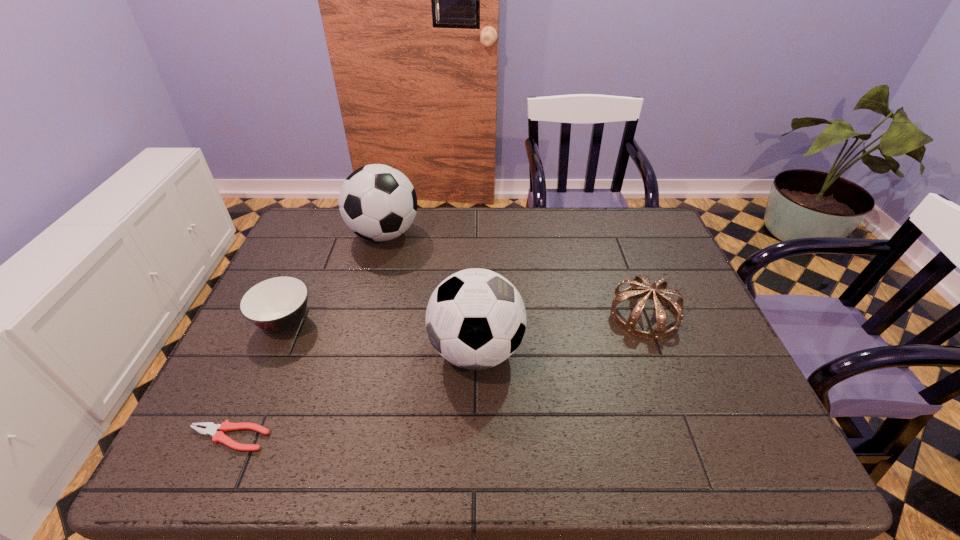
At what (x,y) coordinates should I click in order to perform the action: click on free space at the far edge. Please return your answer as a coordinate pair (x, y). The width and height of the screenshot is (960, 540). Looking at the image, I should click on (516, 234).

Identify the location of free space at the near edge of the desktop. (293, 467).

The width and height of the screenshot is (960, 540). In order to click on free point at the left edge in this screenshot , I will do `click(280, 269)`.

Identify the location of vacant position at the right edge of the desktop. The image size is (960, 540). (683, 326).

Find the location of a particular element. The width and height of the screenshot is (960, 540). free space at the far left corner is located at coordinates (300, 230).

This screenshot has height=540, width=960. Identify the location of blank space at the far right corner. (615, 231).

You are a GUI agent. You are given a task and a screenshot of the screen. Output one action in this format:
    pyautogui.click(x=<x>, y=<y>)
    Task: Click on the free space between the right soccer ball and the left soccer ball
    Image resolution: width=960 pixels, height=540 pixels.
    Given the screenshot: What is the action you would take?
    pyautogui.click(x=430, y=292)

Locate an element on the screen. This screenshot has width=960, height=540. free space between the nearer soccer ball and the rightmost object is located at coordinates (560, 333).

You are a GUI agent. You are given a task and a screenshot of the screen. Output one action in this format:
    pyautogui.click(x=<x>, y=<y>)
    Task: Click on the vacant area between the nearer soccer ball and the rightmost object
    
    Given the screenshot: What is the action you would take?
    pyautogui.click(x=560, y=333)

Where is `vacant space that's between the tiara and the pliers`? This screenshot has width=960, height=540. vacant space that's between the tiara and the pliers is located at coordinates (437, 376).